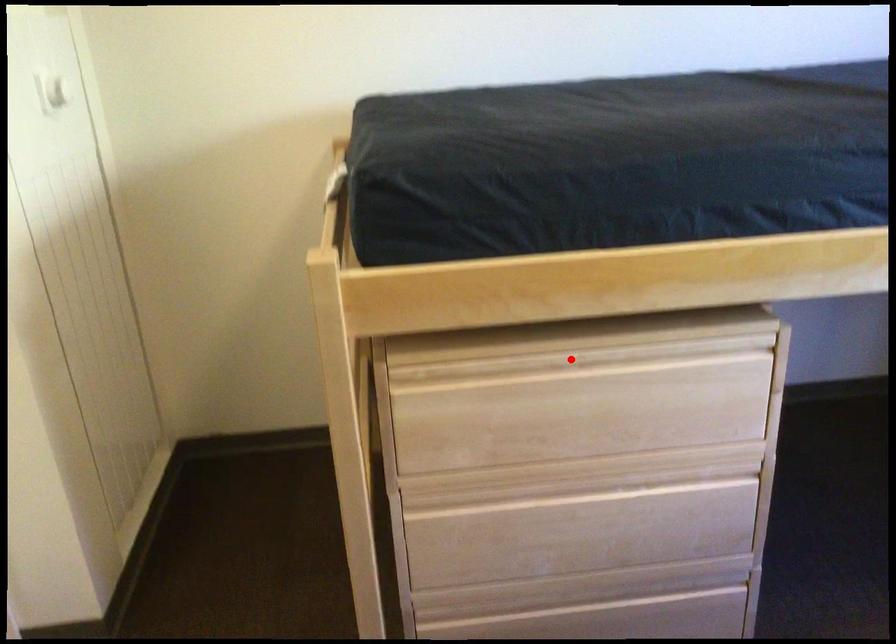
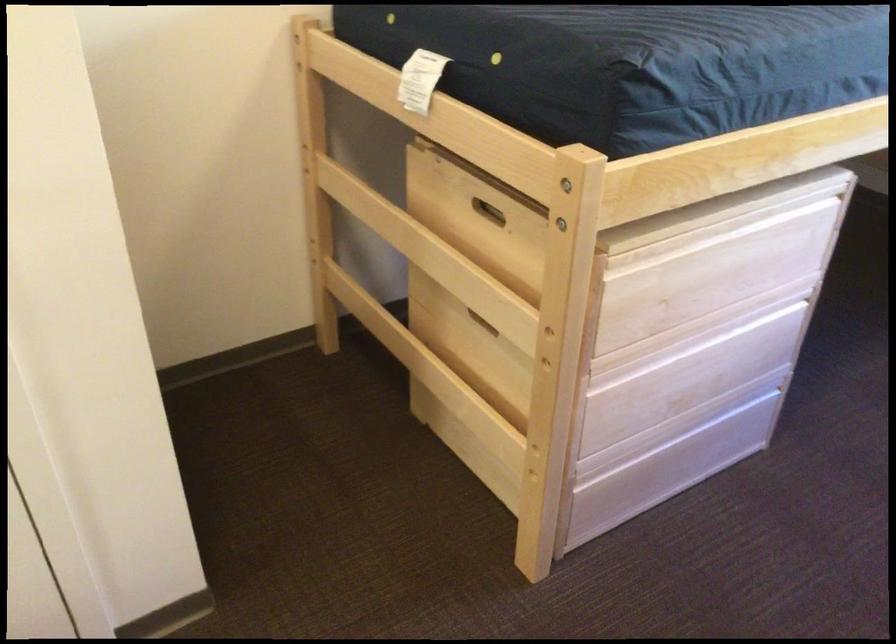
Where in the second image is the point corresponding to the highlighted location from the first image?

(720, 230)